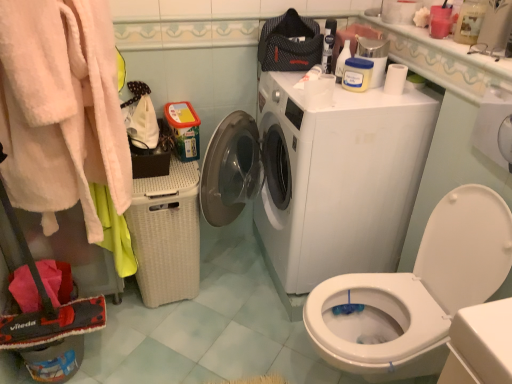
The width and height of the screenshot is (512, 384). I want to click on vacant space that is in between white matte toilet paper at upper right, which appears as the 1th toilet paper when viewed from the left, and matte white jar at upper center, so click(327, 94).